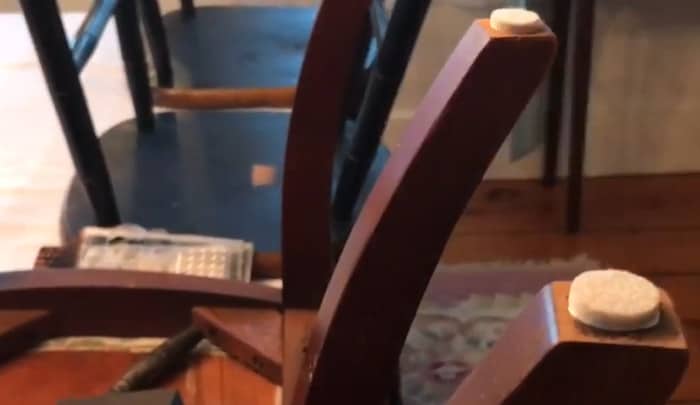
Where is `chair leg`? chair leg is located at coordinates (416, 206), (308, 155), (63, 66), (134, 42), (159, 28), (372, 116), (188, 5).